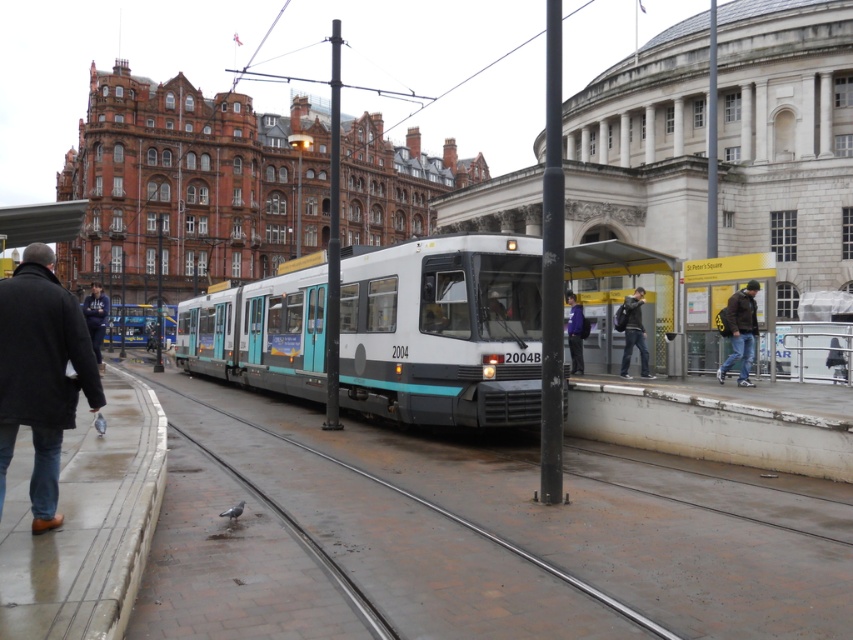
You are a delivery robot with a package that requires a 2 meter wide path to navigate. You need to move from the black matte coat at lower left to the dark blue hoodie at left. Is the space between them sufficient for your movement?

The distance between the black matte coat at lower left and the dark blue hoodie at left is 2.11 meters, which is wider than the required 2 meters. Therefore, the delivery robot can safely navigate through the space between them.

You are a traveler at the tram station and you have a black matte coat at lower left and a matte black backpack at right. You want to place both items on the platform bench. Which item will require more vertical space on the bench?

The matte black backpack at right requires more vertical space on the bench because it is taller than the black matte coat at lower left.